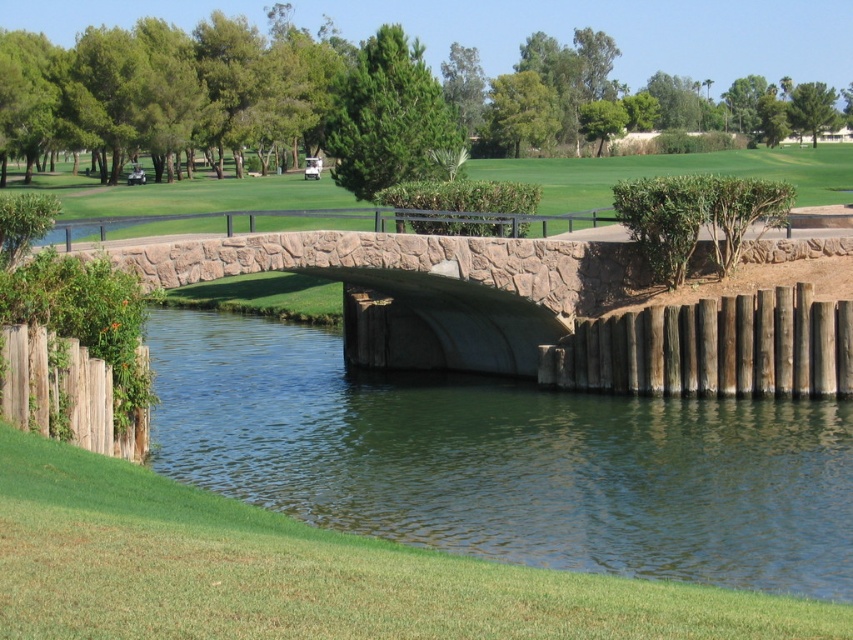
You are a boat captain trying to navigate a narrow boat through the waterway under the smooth stone bridge at center. The boat is 10 meters long. Can you safely pass under the bridge if the green concrete river at center is the waterway beneath it?

The green concrete river at center is shorter than the smooth stone bridge at center, meaning the river is narrower than the bridge. However, the length of the river does not directly affect the boat passing under the bridge. The boat is 10 meters long, and the bridge spans the entire width of the river. Since the bridge is longer than the river, it provides sufficient clearance for the boat to pass underneath as long as the boat fits within the width of the river. Therefore, the boat can safely navigate.